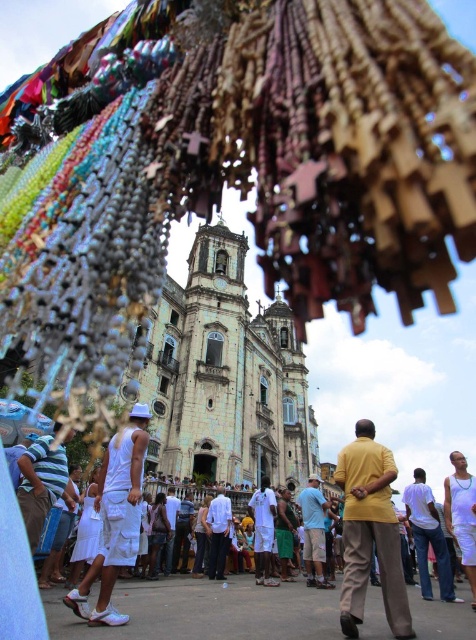
Question: Which of these objects is positioned closest to the yellow matte shirt at center?

Choices:
 (A) white cotton shorts at lower left
 (B) white cotton shirt at center

Answer: (B)

Question: Does yellow matte shirt at center appear on the left side of white matte tank top at center?

Choices:
 (A) yes
 (B) no

Answer: (A)

Question: Which of the following is the closest to the observer?

Choices:
 (A) (469, 492)
 (B) (436, 547)
 (C) (347, 554)
 (D) (148, 433)

Answer: (C)

Question: Which point is farther to the camera?

Choices:
 (A) white cotton shirt at center
 (B) yellow matte shirt at center
 (C) white cotton shorts at lower left

Answer: (A)

Question: Can you confirm if yellow matte shirt at center is positioned to the right of white matte tank top at center?

Choices:
 (A) yes
 (B) no

Answer: (B)

Question: In this image, where is white cotton shorts at lower left located relative to white matte tank top at center?

Choices:
 (A) above
 (B) below

Answer: (A)